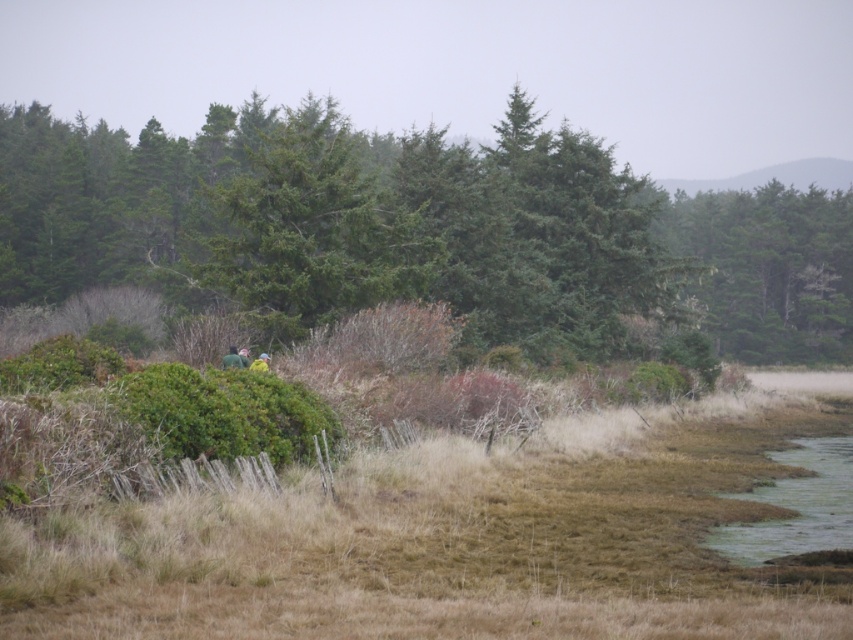
Which of these two, green matte tree at right or green fuzzy jacket at center, stands taller?

Standing taller between the two is green matte tree at right.

Find the location of a particular element. This screenshot has height=640, width=853. green matte tree at right is located at coordinates (769, 269).

Is green textured tree at center closer to the viewer compared to green fuzzy jacket at center?

No, it is not.

What do you see at coordinates (433, 234) in the screenshot? I see `green textured tree at center` at bounding box center [433, 234].

Identify the location of green textured tree at center. This screenshot has height=640, width=853. (433, 234).

Is green matte tree at right bigger than green matte jacket at center?

Indeed, green matte tree at right has a larger size compared to green matte jacket at center.

Is point (677, 253) closer to camera compared to point (260, 355)?

No, (677, 253) is further to viewer.

This screenshot has width=853, height=640. What do you see at coordinates (769, 269) in the screenshot?
I see `green matte tree at right` at bounding box center [769, 269].

Locate an element on the screen. This screenshot has width=853, height=640. green matte tree at right is located at coordinates (769, 269).